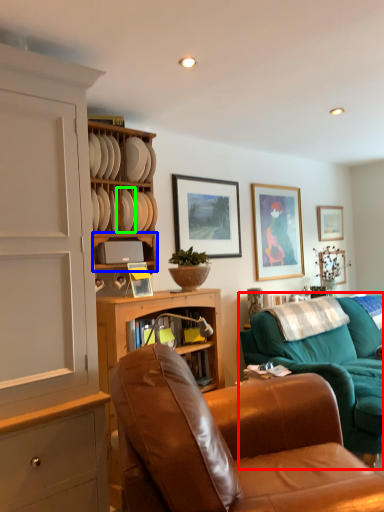
Question: Considering the real-world distances, which object is farthest from studio couch (highlighted by a red box)? shelf (highlighted by a blue box) or plate (highlighted by a green box)?

Choices:
 (A) shelf
 (B) plate

Answer: (B)